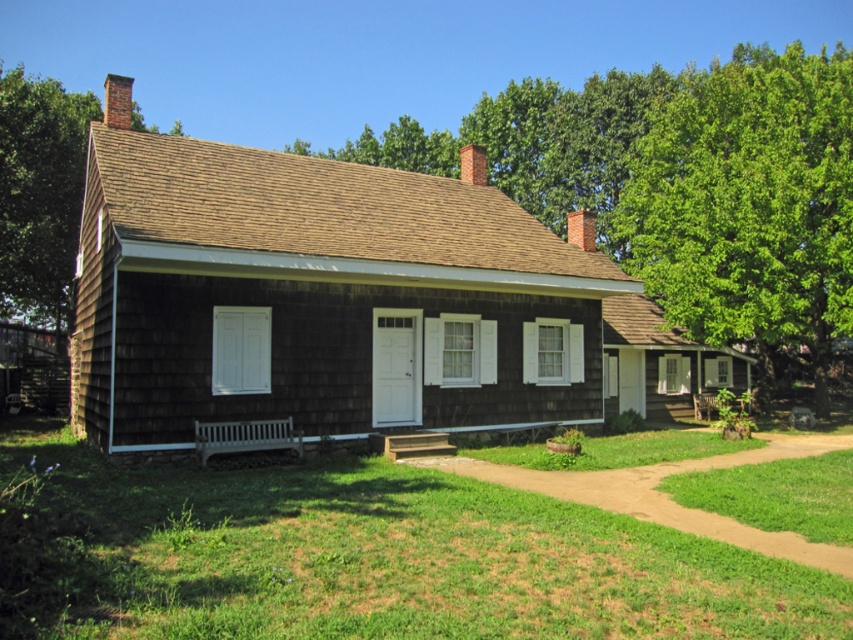
Question: Estimate the real-world distances between objects in this image. Which object is farther from the green leafy tree at upper right?

Choices:
 (A) brown shingles at upper left
 (B) green grass at lower center

Answer: (A)

Question: Is the position of green grass at lower center less distant than that of brown shingles at upper left?

Choices:
 (A) no
 (B) yes

Answer: (B)

Question: Among these points, which one is nearest to the camera?

Choices:
 (A) (297, 545)
 (B) (61, 262)
 (C) (743, 228)

Answer: (A)

Question: Can you confirm if green grass at lower center is bigger than brown shingles at upper left?

Choices:
 (A) yes
 (B) no

Answer: (B)

Question: Does green grass at lower center appear under green leafy tree at upper right?

Choices:
 (A) yes
 (B) no

Answer: (A)

Question: Which point is farther to the camera?

Choices:
 (A) (703, 314)
 (B) (384, 497)
 (C) (12, 68)

Answer: (C)